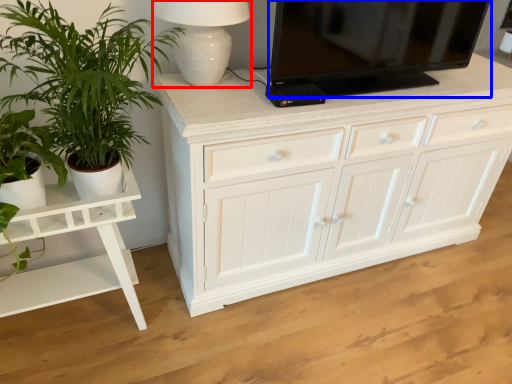
Question: Which of the following is the farthest to the observer, table lamp (highlighted by a red box) or television (highlighted by a blue box)?

Choices:
 (A) table lamp
 (B) television

Answer: (B)